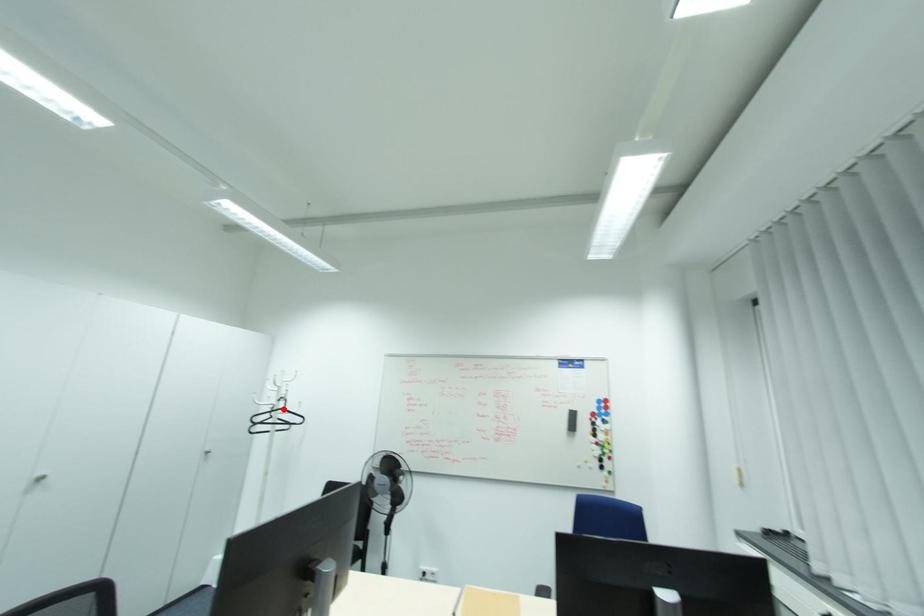
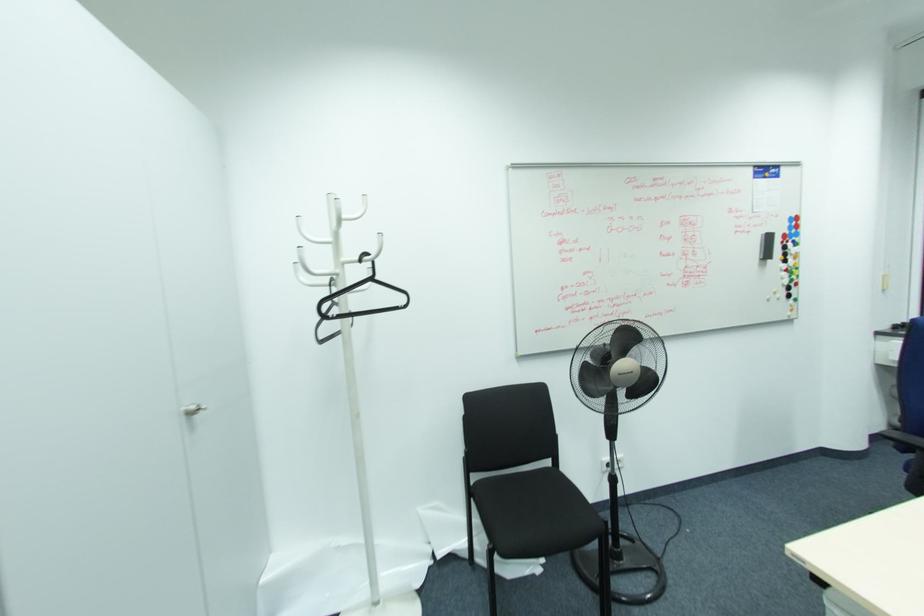
Where in the second image is the point corresponding to the highlighted location from the first image?

(371, 280)